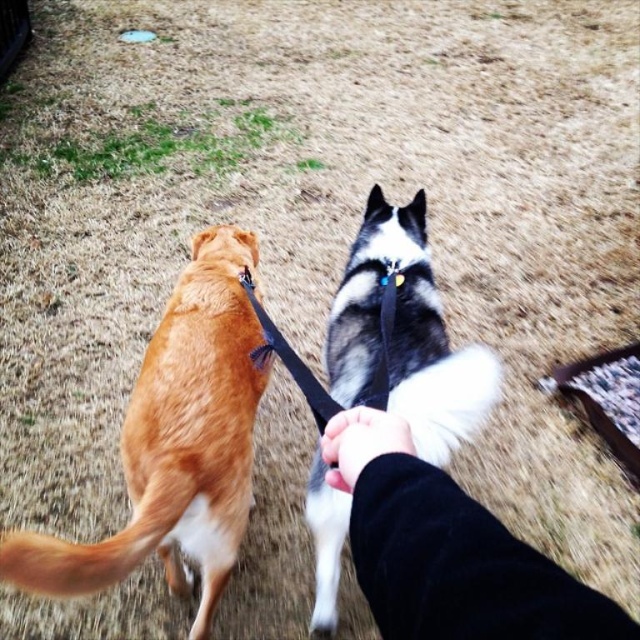
You are a dog walker trying to fit both dogs between two trees that are 3 meters apart. Given the golden fur dog at left and the black and white fur at center, which dog has a larger width and would require more space between them?

The golden fur dog at left has a larger width than the black and white fur at center, so it would require more space between them to fit through the gap between the trees.

You are holding two dogs on leashes and want to move forward. There are two points marked in the image. The first point is at coordinate point (220,273) and the second is at point (332,552). Which point should you aim for first to ensure you walk in the direction the dogs are facing?

You should aim for point (220,273) first because it is in front of point (332,552), indicating it is closer to the direction the dogs are facing.

You are a photographer trying to capture a clear shot of the black fleece hand at center and the black and white fur at center. Which object takes up more area in the image?

The black and white fur at center takes up more area in the image than the black fleece hand at center because the black fleece hand at center occupies less space than black and white fur at center.